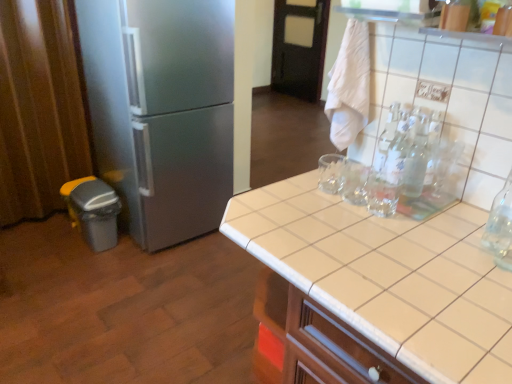
Question: Is brown fabric curtain at left at the back of black wood door at upper center?

Choices:
 (A) yes
 (B) no

Answer: (B)

Question: Is black wood door at upper center facing towards brown fabric curtain at left?

Choices:
 (A) no
 (B) yes

Answer: (B)

Question: Is black wood door at upper center wider than brown fabric curtain at left?

Choices:
 (A) yes
 (B) no

Answer: (B)

Question: From the image's perspective, would you say black wood door at upper center is positioned over brown fabric curtain at left?

Choices:
 (A) yes
 (B) no

Answer: (A)

Question: Considering the relative positions of black wood door at upper center and brown fabric curtain at left in the image provided, is black wood door at upper center to the left of brown fabric curtain at left from the viewer's perspective?

Choices:
 (A) yes
 (B) no

Answer: (B)

Question: Visually, is clear glass bottle at upper right positioned to the left or to the right of black wood door at upper center?

Choices:
 (A) right
 (B) left

Answer: (B)

Question: Considering their positions, is clear glass bottle at upper right located in front of or behind black wood door at upper center?

Choices:
 (A) behind
 (B) front

Answer: (B)

Question: From the image's perspective, is clear glass bottle at upper right above or below black wood door at upper center?

Choices:
 (A) above
 (B) below

Answer: (B)

Question: Is point (396, 142) positioned closer to the camera than point (316, 14)?

Choices:
 (A) closer
 (B) farther

Answer: (A)

Question: Is satin silver refrigerator at left bigger or smaller than white tile countertop at center?

Choices:
 (A) small
 (B) big

Answer: (B)

Question: From a real-world perspective, is satin silver refrigerator at left above or below white tile countertop at center?

Choices:
 (A) below
 (B) above

Answer: (B)

Question: Is satin silver refrigerator at left in front of or behind white tile countertop at center in the image?

Choices:
 (A) front
 (B) behind

Answer: (B)

Question: Considering the relative positions of satin silver refrigerator at left and white tile countertop at center in the image provided, is satin silver refrigerator at left to the left or to the right of white tile countertop at center?

Choices:
 (A) left
 (B) right

Answer: (A)

Question: Considering the positions of white tile countertop at center and black wood door at upper center in the image, is white tile countertop at center wider or thinner than black wood door at upper center?

Choices:
 (A) thin
 (B) wide

Answer: (B)

Question: Is white tile countertop at center bigger or smaller than black wood door at upper center?

Choices:
 (A) big
 (B) small

Answer: (A)